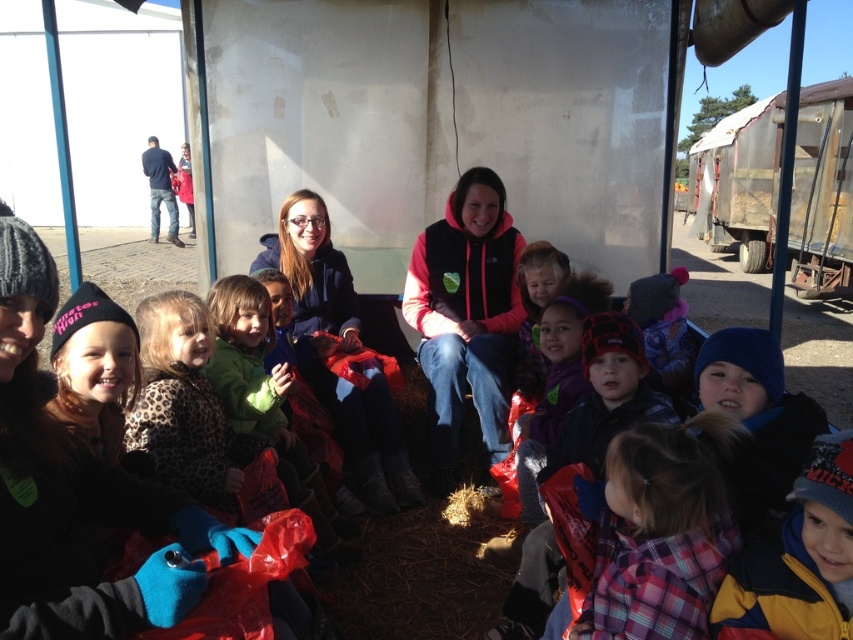
Looking at this image, you are a photographer trying to take a photo of the leopard print coat at center and the pink fleece vest at center. Since you want to ensure both are visible, which one should you focus on first to avoid blurring the one in the front?

You should focus on the leopard print coat at center first because it is behind the pink fleece vest at center, so adjusting focus starting from the back ensures both are sharp.

In the scene shown: You are a photographer standing at the camera position. You want to take a closeup shot of the matte blue hoodie at center. Do you think you can get a clear closeup without moving your position?

The matte blue hoodie at center is 3.40 meters away from camera, so yes, you can get a clear closeup without moving your position as most cameras can focus clearly at that distance.